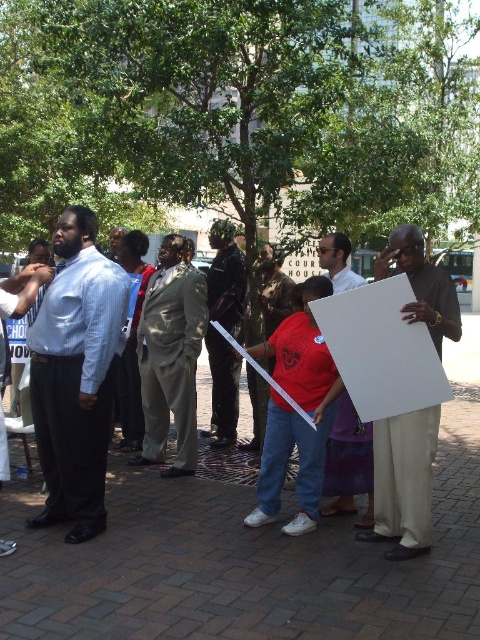
Question: Can you confirm if matte white sign at right is bigger than dark gray suit at center?

Choices:
 (A) no
 (B) yes

Answer: (A)

Question: Which object is the closest to the matte white sign at right?

Choices:
 (A) light blue shirt at left
 (B) dark gray suit at center
 (C) white paper at center
 (D) light gray suit at center

Answer: (C)

Question: Is the position of matte white sign at right less distant than that of dark gray suit at center?

Choices:
 (A) yes
 (B) no

Answer: (A)

Question: Is the position of light blue shirt at left less distant than that of white paper at center?

Choices:
 (A) no
 (B) yes

Answer: (B)

Question: Which object is closer to the camera taking this photo?

Choices:
 (A) light gray suit at center
 (B) dark gray suit at center
 (C) matte white sign at right

Answer: (C)

Question: Based on their relative distances, which object is farther from the white paper at center?

Choices:
 (A) matte white sign at right
 (B) light blue shirt at left
 (C) light gray suit at center

Answer: (C)